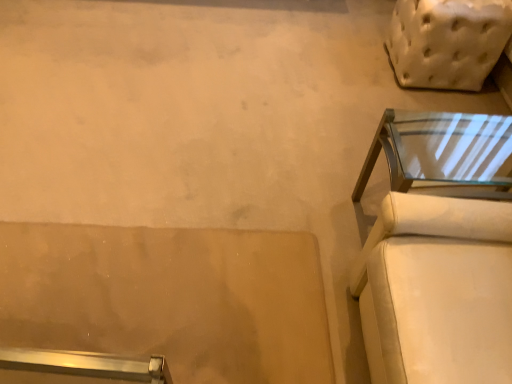
Describe the element at coordinates (447, 41) in the screenshot. This screenshot has width=512, height=384. I see `white tufted ottoman at upper right` at that location.

Where is `white tufted ottoman at upper right`? This screenshot has width=512, height=384. white tufted ottoman at upper right is located at coordinates (447, 41).

At what (x,y) coordinates should I click in order to perform the action: click on white tufted ottoman at upper right. Please return your answer as a coordinate pair (x, y). The image size is (512, 384). Looking at the image, I should click on (447, 41).